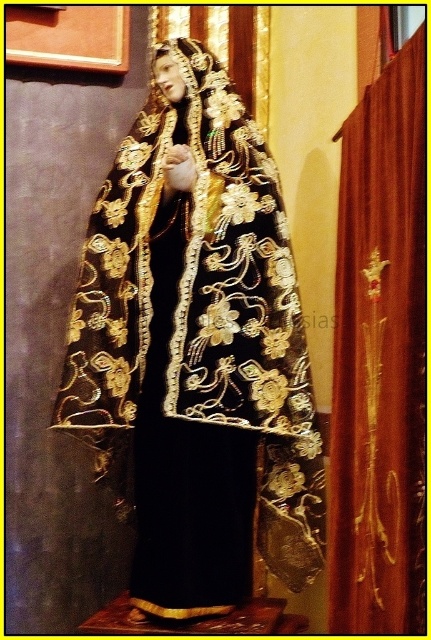
Question: Does black velvet cape at center have a lesser width compared to burgundy velvet curtain at right?

Choices:
 (A) yes
 (B) no

Answer: (B)

Question: Is black velvet cape at center positioned at the back of burgundy velvet curtain at right?

Choices:
 (A) yes
 (B) no

Answer: (A)

Question: Among these points, which one is farthest from the camera?

Choices:
 (A) (203, 412)
 (B) (421, 84)

Answer: (A)

Question: Does black velvet cape at center have a lesser width compared to burgundy velvet curtain at right?

Choices:
 (A) yes
 (B) no

Answer: (B)

Question: Which point is farther to the camera?

Choices:
 (A) black velvet cape at center
 (B) burgundy velvet curtain at right

Answer: (A)

Question: Which object is closer to the camera taking this photo?

Choices:
 (A) burgundy velvet curtain at right
 (B) black velvet cape at center

Answer: (A)